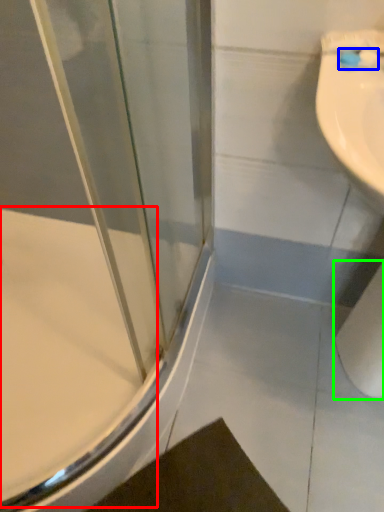
Question: Based on their relative distances, which object is farther from bath (highlighted by a red box)? Choose from toothbrush (highlighted by a blue box) and toilet paper (highlighted by a green box).

Choices:
 (A) toothbrush
 (B) toilet paper

Answer: (A)